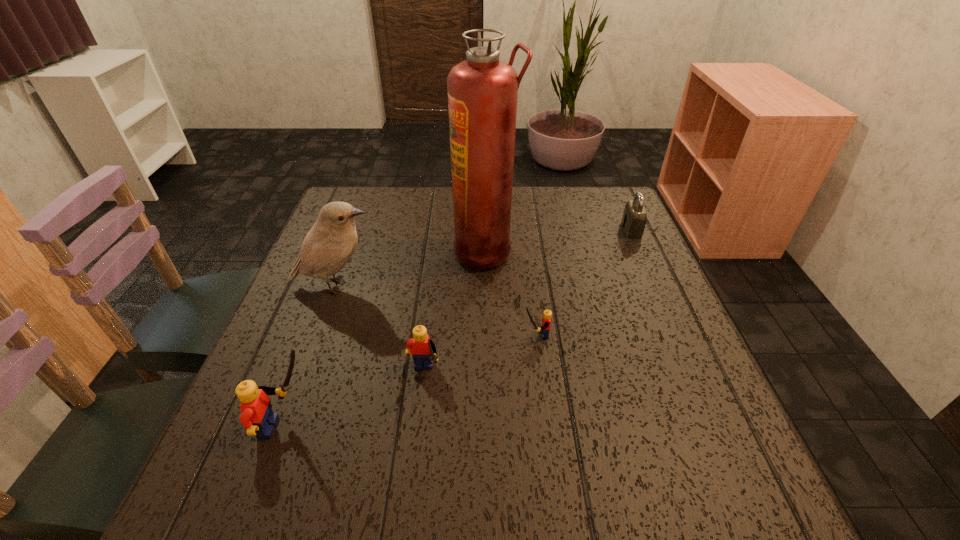
Identify the location of free point located on the side of the fire extinguisher with the label. (367, 251).

Where is `free space located 0.060m at the beak of the bird`? The width and height of the screenshot is (960, 540). free space located 0.060m at the beak of the bird is located at coordinates click(404, 286).

You are a GUI agent. You are given a task and a screenshot of the screen. Output one action in this format:
    pyautogui.click(x=<x>, y=<y>)
    Task: Click on the object situated at the far edge
    The image size is (960, 540).
    Given the screenshot: What is the action you would take?
    pyautogui.click(x=634, y=219)

Locate an element on the screen. The height and width of the screenshot is (540, 960). object present at the near edge is located at coordinates (257, 417).

Locate an element on the screen. Lego at the left edge is located at coordinates (257, 417).

This screenshot has width=960, height=540. Identify the location of bird located in the left edge section of the desktop. (330, 243).

Locate an element on the screen. The height and width of the screenshot is (540, 960). object present at the right edge is located at coordinates (634, 219).

This screenshot has width=960, height=540. What are the coordinates of `object situated at the near left corner` in the screenshot? It's located at (257, 417).

Where is `object at the far right corner`? object at the far right corner is located at coordinates (634, 219).

I want to click on vacant position at the far edge of the desktop, so click(x=558, y=205).